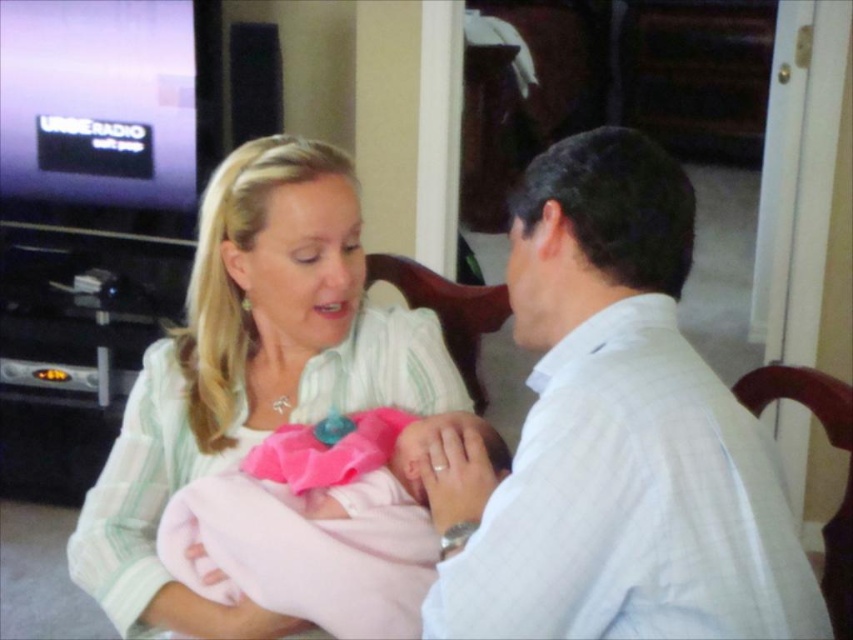
You are a photographer trying to capture a closeup of the pink satin baby at center without the pink fabric baby at center blocking the view. Can you move the camera to the side to get a clear shot?

The pink satin baby at center is behind the pink fabric baby at center, so moving the camera to the side might allow you to capture the pink satin baby at center without obstruction.